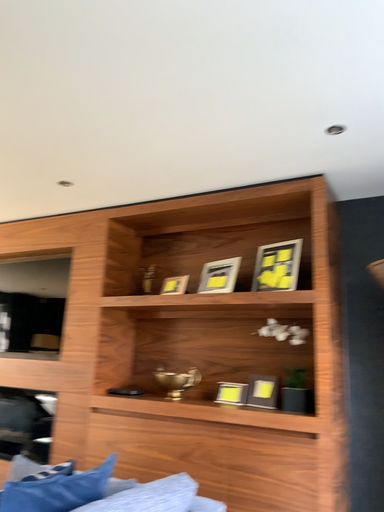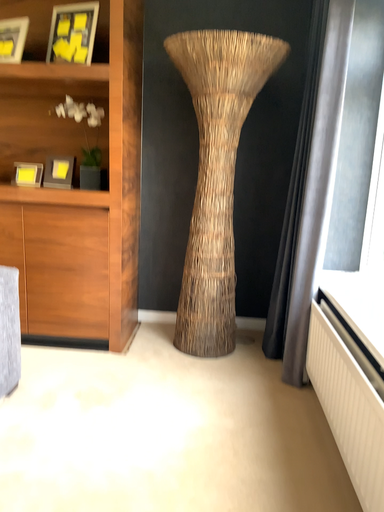
Question: How did the camera likely rotate when shooting the video?

Choices:
 (A) rotated right
 (B) rotated left

Answer: (A)